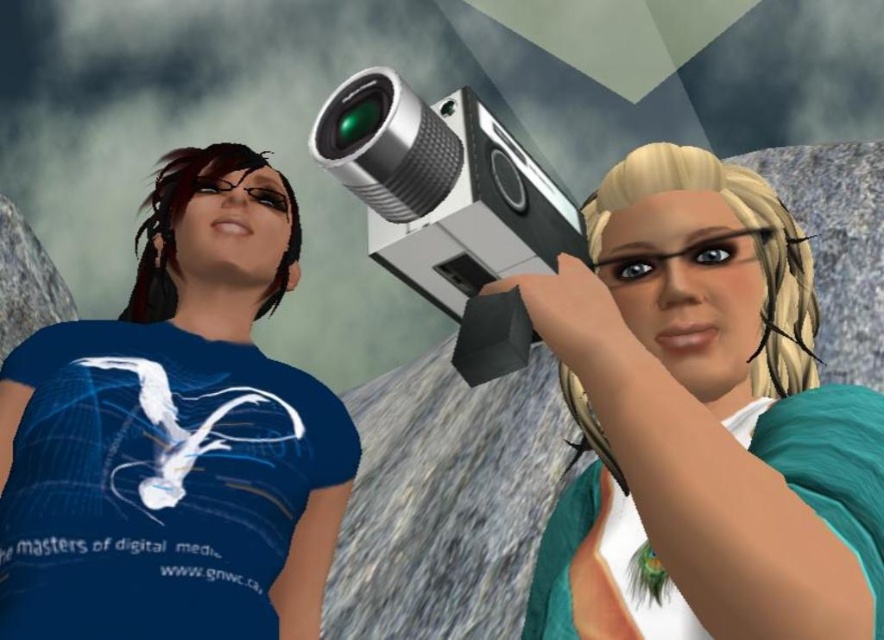
Question: Which point is farther to the camera?

Choices:
 (A) metallic silver video camera at center
 (B) shiny silver camera at center
 (C) blue matte t-shirt at left

Answer: (C)

Question: Does shiny silver camera at center come behind blue matte t-shirt at left?

Choices:
 (A) yes
 (B) no

Answer: (B)

Question: Which point is farther to the camera?

Choices:
 (A) metallic silver video camera at center
 (B) shiny silver camera at center

Answer: (A)

Question: Is the position of blue matte t-shirt at left more distant than that of metallic silver video camera at center?

Choices:
 (A) no
 (B) yes

Answer: (B)

Question: Considering the real-world distances, which object is farthest from the blue matte t-shirt at left?

Choices:
 (A) metallic silver video camera at center
 (B) shiny silver camera at center

Answer: (A)

Question: Can you confirm if shiny silver camera at center is positioned to the right of metallic silver video camera at center?

Choices:
 (A) yes
 (B) no

Answer: (A)